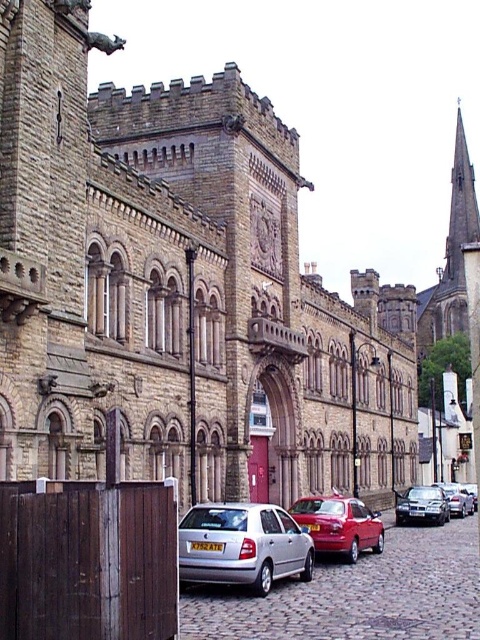
You are standing in front of a historic medieval building with a cobblestone path leading to its entrance. You see a point marked at coordinates (242,545). What object is located at that point?

The point at coordinates (242,545) corresponds to the silver metallic hatchback at lower center.

You are standing at the entrance of the historic building and want to park your shiny red car at center. According to the coordinates provided, where should you position the car relative to the building?

The shiny red car at center should be positioned at coordinates point (338,524) relative to the building.

You are a tour guide leading a group to a historic building. You have a silver metallic hatchback at lower center and a silver metallic car at right parked in front of the building. The tour group needs to walk from the hatchback to the car. Are they able to walk directly between the two vehicles without needing to go around them?

The silver metallic hatchback at lower center and silver metallic car at right are 162.83 feet apart from each other, so yes, the tour group can walk directly between the two vehicles without needing to go around them since the distance is sufficient for a path.